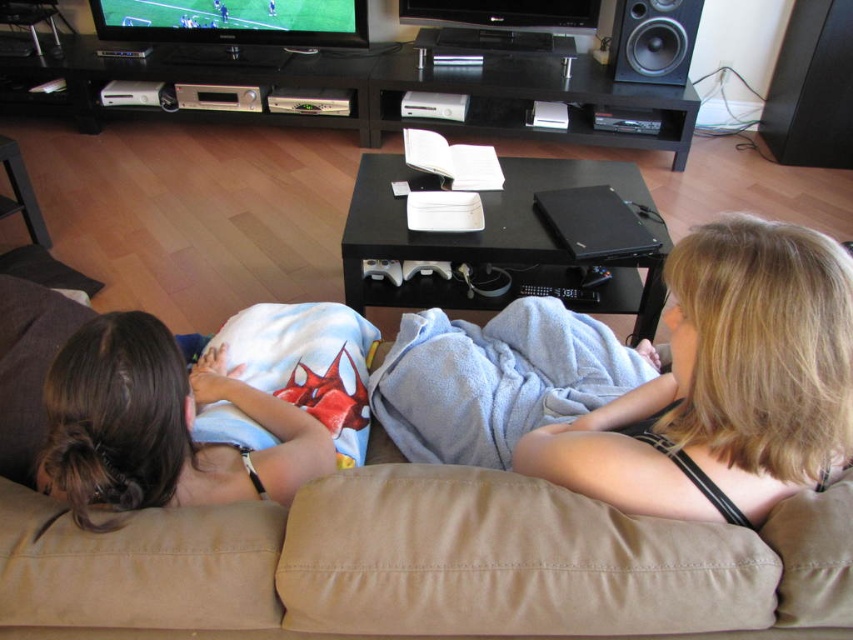
Looking at this image, is black glossy entertainment center at upper center shorter than black matte speaker at upper right?

No, black glossy entertainment center at upper center is not shorter than black matte speaker at upper right.

Between black glossy entertainment center at upper center and black matte speaker at upper right, which one is positioned higher?

black matte speaker at upper right

Locate an element on the screen. black glossy entertainment center at upper center is located at coordinates (380, 88).

Where is `black glossy entertainment center at upper center`? Image resolution: width=853 pixels, height=640 pixels. black glossy entertainment center at upper center is located at coordinates point(380,88).

Can you confirm if blonde hair at center is thinner than black glossy entertainment center at upper center?

Indeed, blonde hair at center has a lesser width compared to black glossy entertainment center at upper center.

This screenshot has height=640, width=853. What do you see at coordinates (724, 385) in the screenshot? I see `blonde hair at center` at bounding box center [724, 385].

Where is `blonde hair at center`? blonde hair at center is located at coordinates (724, 385).

Does brown fabric couch at center appear on the right side of light blue fabric blanket at left?

Yes, brown fabric couch at center is to the right of light blue fabric blanket at left.

Between brown fabric couch at center and light blue fabric blanket at left, which one has less height?

light blue fabric blanket at left

The height and width of the screenshot is (640, 853). I want to click on brown fabric couch at center, so click(x=426, y=563).